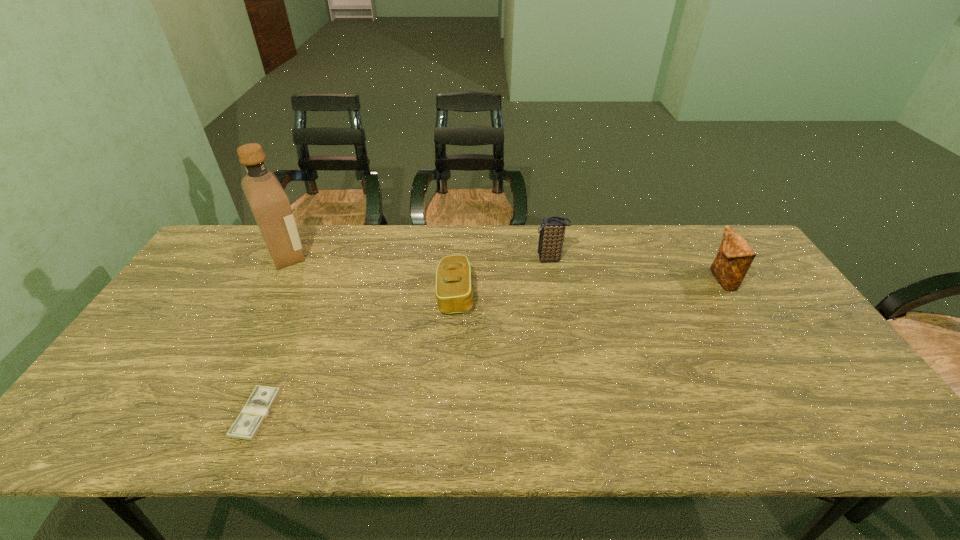
Choose which clutch bag is the nearest neighbor to the fourth tallest object. Please provide its 2D coordinates. Your answer should be formatted as a tuple, i.e. [(x, y)], where the tuple contains the x and y coordinates of a point satisfying the conditions above.

[(552, 229)]

Image resolution: width=960 pixels, height=540 pixels. Find the location of `free location that satisfies the following two spatial constraints: 1. on the front-facing side of the nearest object; 2. on the left side of the liquor`. free location that satisfies the following two spatial constraints: 1. on the front-facing side of the nearest object; 2. on the left side of the liquor is located at coordinates (202, 414).

Where is `vacant region that satisfies the following two spatial constraints: 1. on the zipper side of the third object from right to left; 2. on the front side of the fourth object from right to left`? The image size is (960, 540). vacant region that satisfies the following two spatial constraints: 1. on the zipper side of the third object from right to left; 2. on the front side of the fourth object from right to left is located at coordinates (448, 414).

You are a GUI agent. You are given a task and a screenshot of the screen. Output one action in this format:
    pyautogui.click(x=<x>, y=<y>)
    Task: Click on the vacant space that satisfies the following two spatial constraints: 1. with the zip open on the second clutch bag from right to left; 2. on the front side of the nearest object
    The image size is (960, 540).
    Given the screenshot: What is the action you would take?
    pyautogui.click(x=580, y=414)

Find the location of a particular element. This screenshot has height=540, width=960. vacant space that satisfies the following two spatial constraints: 1. on the zipper side of the fourth tallest object; 2. on the front side of the fourth object from right to left is located at coordinates (448, 414).